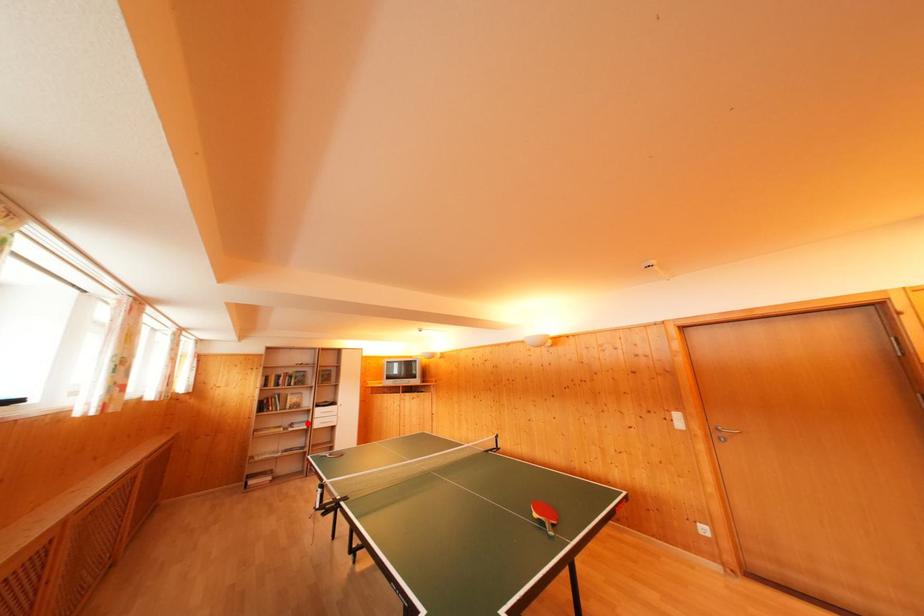
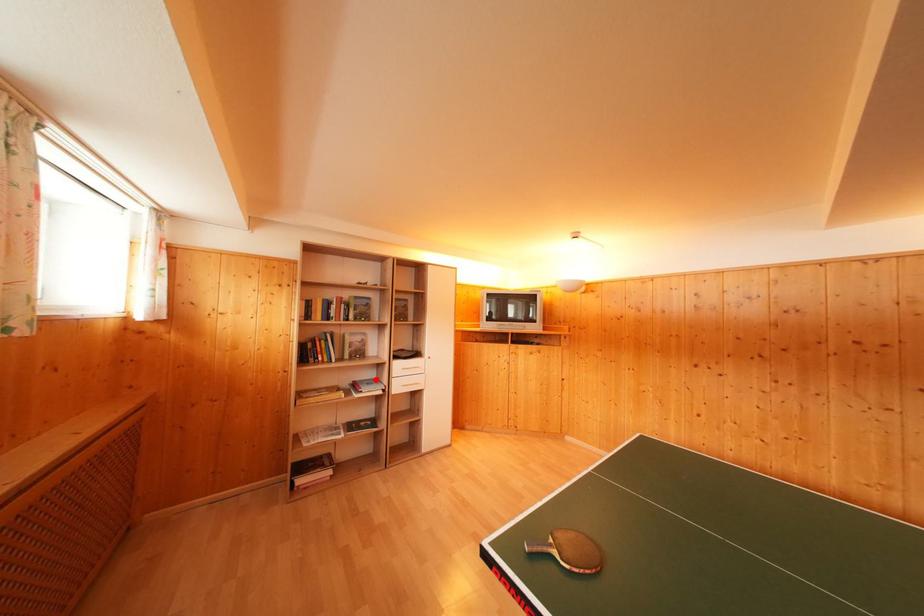
I am providing you with two images of the same scene from different viewpoints. A red point is marked on the first image and another point is marked on the second image. Is the red point in image1 aligned with the point shown in image2?

Yes